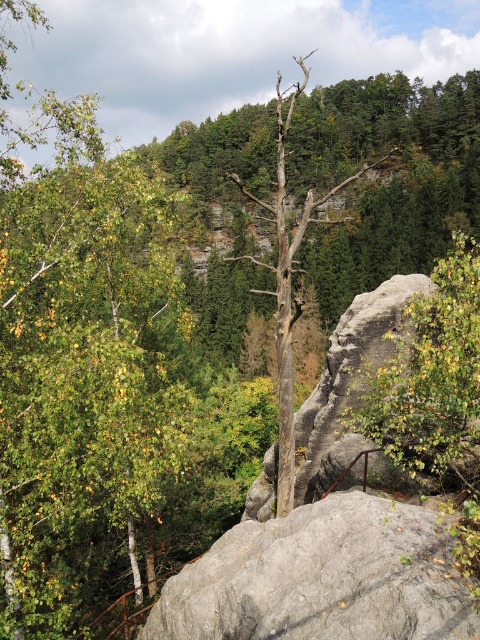
In order to click on gray rough boulder at center in this screenshot , I will do `click(323, 579)`.

Who is more distant from viewer, (x=333, y=561) or (x=417, y=340)?

Point (x=417, y=340)

Identify the location of gray rough boulder at center. (323, 579).